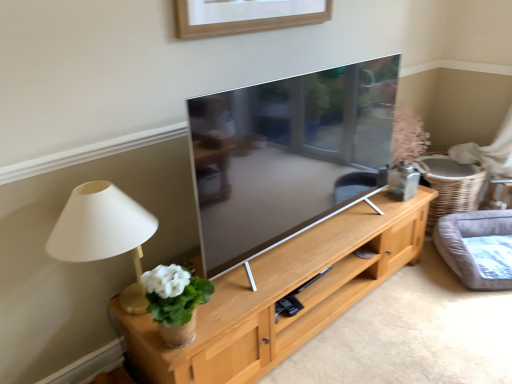
The width and height of the screenshot is (512, 384). Identify the location of free location to the left of gray fabric cat bed at right. (420, 285).